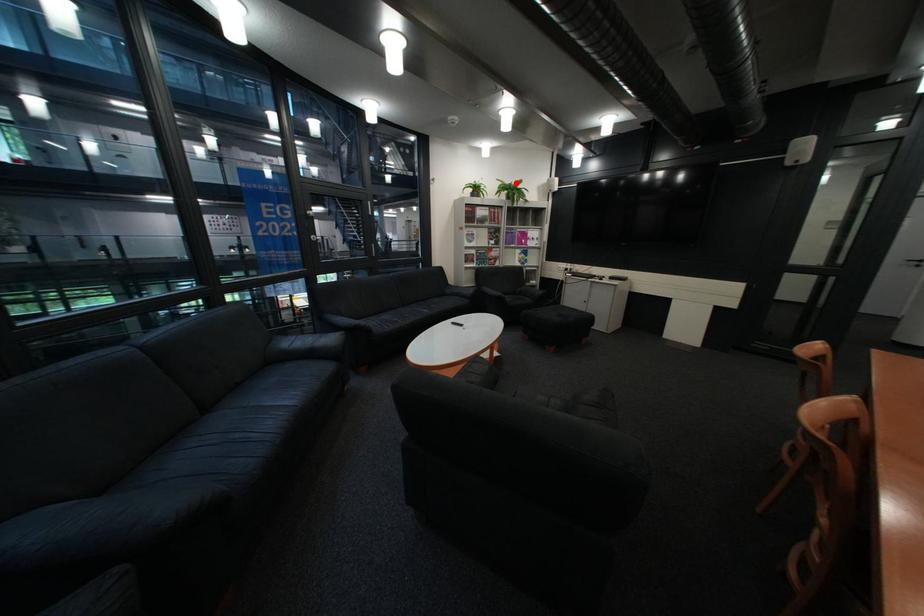
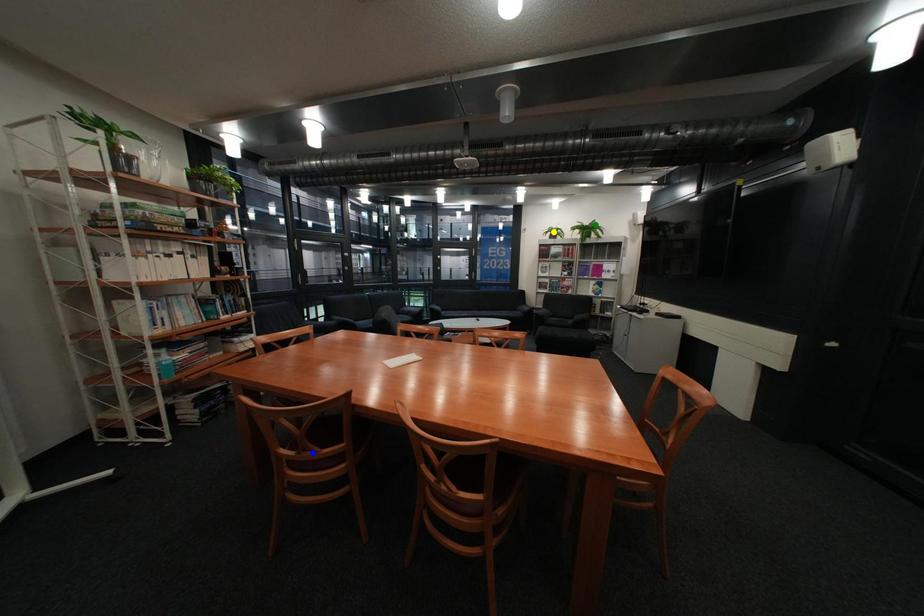
Question: I am providing you with two images of the same scene from different viewpoints. A red point is marked on the first image. You are given multiple points on the second image. Which spot in image 2 lines up with the point in image 1?

Choices:
 (A) yellow point
 (B) green point
 (C) blue point

Answer: (B)